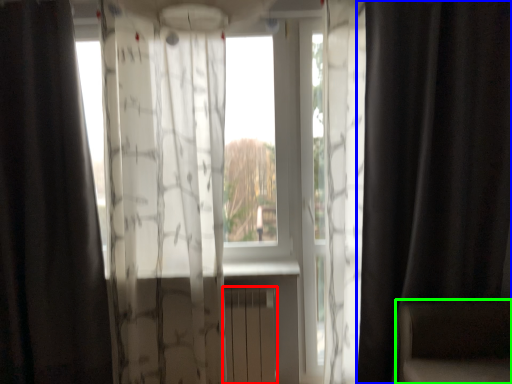
Question: Which object is the farthest from radiator (highlighted by a red box)? Choose among these: curtain (highlighted by a blue box) or armchair (highlighted by a green box).

Choices:
 (A) curtain
 (B) armchair

Answer: (A)